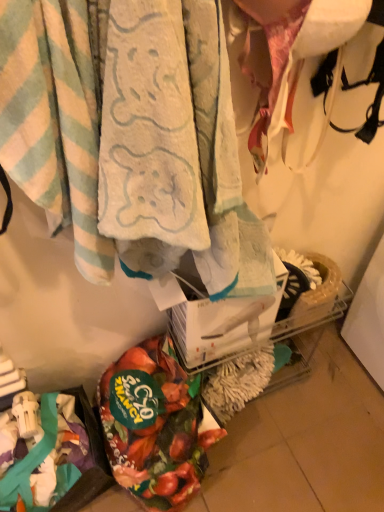
Question: From a real-world perspective, is light blue striped towel at upper left, arranged as the second towel when viewed from the right, below soft cotton towel at center, which ranks as the 2th towel in left-to-right order?

Choices:
 (A) yes
 (B) no

Answer: (B)

Question: Are light blue striped towel at upper left, arranged as the second towel when viewed from the right, and soft cotton towel at center, which ranks as the 2th towel in left-to-right order, making contact?

Choices:
 (A) yes
 (B) no

Answer: (A)

Question: Does light blue striped towel at upper left, arranged as the second towel when viewed from the right, have a larger size compared to soft cotton towel at center, which ranks as the 2th towel in left-to-right order?

Choices:
 (A) yes
 (B) no

Answer: (B)

Question: Considering the relative positions of light blue striped towel at upper left, arranged as the second towel when viewed from the right, and soft cotton towel at center, which ranks as the 2th towel in left-to-right order, in the image provided, is light blue striped towel at upper left, arranged as the second towel when viewed from the right, to the right of soft cotton towel at center, which ranks as the 2th towel in left-to-right order, from the viewer's perspective?

Choices:
 (A) yes
 (B) no

Answer: (B)

Question: Can you confirm if light blue striped towel at upper left, arranged as the second towel when viewed from the right, is shorter than soft cotton towel at center, which appears as the first towel when viewed from the right?

Choices:
 (A) yes
 (B) no

Answer: (B)

Question: From a real-world perspective, is light blue striped towel at upper left, marked as the 1th towel in a left-to-right arrangement, above or below soft cotton towel at center, which appears as the first towel when viewed from the right?

Choices:
 (A) above
 (B) below

Answer: (A)

Question: Considering the positions of light blue striped towel at upper left, marked as the 1th towel in a left-to-right arrangement, and soft cotton towel at center, which appears as the first towel when viewed from the right, in the image, is light blue striped towel at upper left, marked as the 1th towel in a left-to-right arrangement, bigger or smaller than soft cotton towel at center, which appears as the first towel when viewed from the right,?

Choices:
 (A) big
 (B) small

Answer: (B)

Question: Is light blue striped towel at upper left, marked as the 1th towel in a left-to-right arrangement, wider or thinner than soft cotton towel at center, which ranks as the 2th towel in left-to-right order?

Choices:
 (A) thin
 (B) wide

Answer: (A)

Question: Relative to soft cotton towel at center, which appears as the first towel when viewed from the right, is light blue striped towel at upper left, arranged as the second towel when viewed from the right, in front or behind?

Choices:
 (A) front
 (B) behind

Answer: (A)

Question: From their relative heights in the image, would you say floral fabric bag at lower left is taller or shorter than light blue striped towel at upper left, marked as the 1th towel in a left-to-right arrangement?

Choices:
 (A) tall
 (B) short

Answer: (B)

Question: Is floral fabric bag at lower left in front of or behind light blue striped towel at upper left, marked as the 1th towel in a left-to-right arrangement, in the image?

Choices:
 (A) behind
 (B) front

Answer: (A)

Question: Looking at the image, does floral fabric bag at lower left seem bigger or smaller compared to light blue striped towel at upper left, marked as the 1th towel in a left-to-right arrangement?

Choices:
 (A) big
 (B) small

Answer: (B)

Question: Would you say floral fabric bag at lower left is inside or outside light blue striped towel at upper left, arranged as the second towel when viewed from the right?

Choices:
 (A) outside
 (B) inside

Answer: (A)

Question: Considering the positions of floral fabric bag at lower left and soft cotton towel at center, which appears as the first towel when viewed from the right, in the image, is floral fabric bag at lower left wider or thinner than soft cotton towel at center, which appears as the first towel when viewed from the right,?

Choices:
 (A) thin
 (B) wide

Answer: (B)

Question: Relative to soft cotton towel at center, which ranks as the 2th towel in left-to-right order, is floral fabric bag at lower left in front or behind?

Choices:
 (A) behind
 (B) front

Answer: (A)